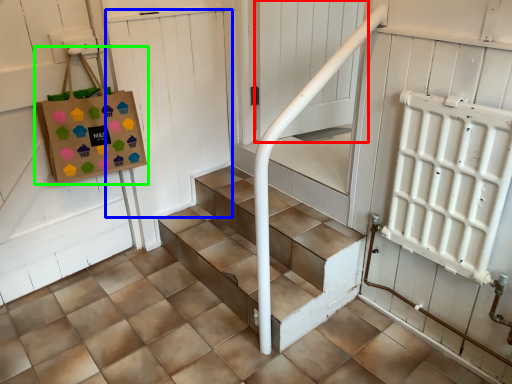
Question: Which is nearer to the screen door (highlighted by a red box)? door (highlighted by a blue box) or bag (highlighted by a green box).

Choices:
 (A) door
 (B) bag

Answer: (A)